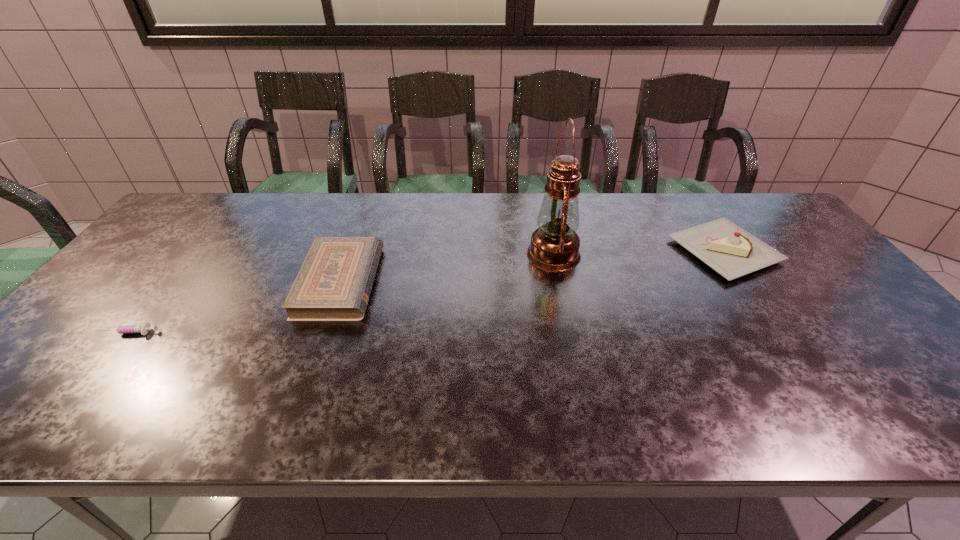
Choose which object is the third nearest neighbor to the cake. Please provide its 2D coordinates. Your answer should be formatted as a tuple, i.e. [(x, y)], where the tuple contains the x and y coordinates of a point satisfying the conditions above.

[(128, 329)]

Locate an element on the screen. This screenshot has height=540, width=960. the third closest object to the shortest object is located at coordinates (731, 251).

Locate an element on the screen. This screenshot has width=960, height=540. vacant space that satisfies the following two spatial constraints: 1. on the back side of the syringe; 2. on the right side of the cake is located at coordinates (194, 251).